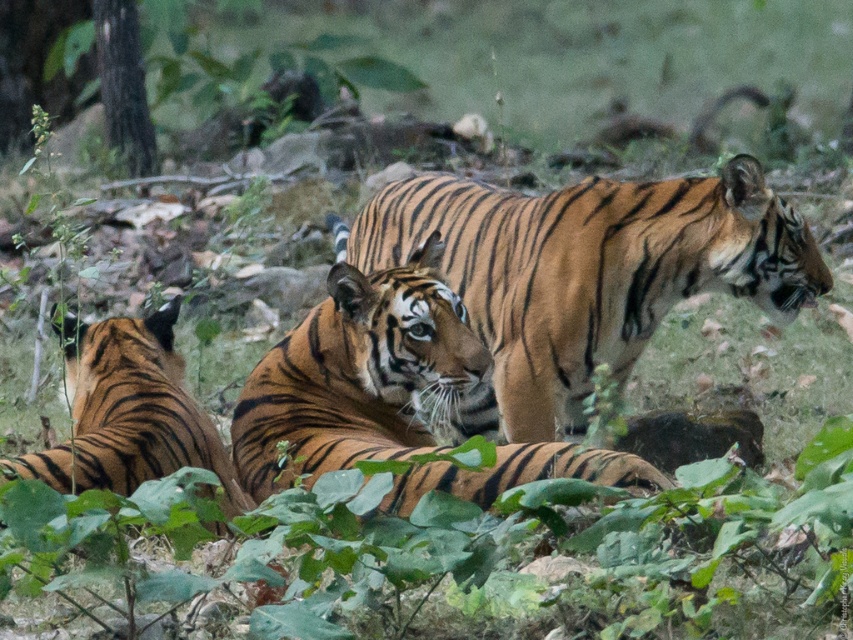
You are a wildlife photographer who wants to take a closeup shot of the orange fur with black stripes of the tiger at the point marked by coordinates point [585,273]. Based on the scene description, which tiger should you focus on?

The point [585,273] is on orange brown striped tiger at center, so you should focus on the orange brown striped tiger at center to capture the orange fur with black stripes.

You are a wildlife photographer trying to capture a clear image of the tiger lying down in the center of the scene. There is a point at coordinates (556, 547) in the image. What is located at this point that might obstruct your view of the tiger?

The point at coordinates (556, 547) is on green leafy foliage at center, which could obstruct the view of the tiger lying down in the center.